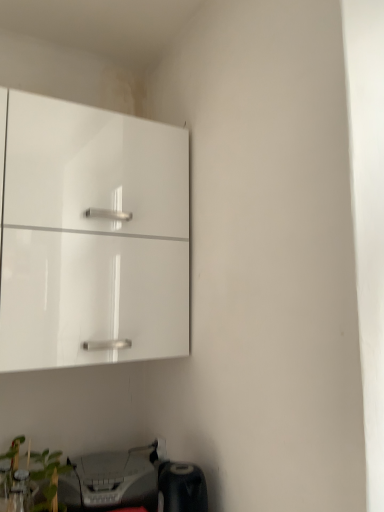
Question: Could green leafy plant at lower left be considered to be inside matte gray printer at lower left?

Choices:
 (A) no
 (B) yes

Answer: (A)

Question: Does matte gray printer at lower left turn towards green leafy plant at lower left?

Choices:
 (A) no
 (B) yes

Answer: (A)

Question: Does matte gray printer at lower left have a larger size compared to green leafy plant at lower left?

Choices:
 (A) no
 (B) yes

Answer: (B)

Question: Does matte gray printer at lower left have a smaller size compared to green leafy plant at lower left?

Choices:
 (A) no
 (B) yes

Answer: (A)

Question: Is matte gray printer at lower left turned away from green leafy plant at lower left?

Choices:
 (A) no
 (B) yes

Answer: (A)

Question: From their relative heights in the image, would you say glossy white cabinet at upper left is taller or shorter than matte gray printer at lower left?

Choices:
 (A) short
 (B) tall

Answer: (B)

Question: From a real-world perspective, is glossy white cabinet at upper left positioned above or below matte gray printer at lower left?

Choices:
 (A) above
 (B) below

Answer: (A)

Question: Relative to matte gray printer at lower left, is glossy white cabinet at upper left in front or behind?

Choices:
 (A) front
 (B) behind

Answer: (A)

Question: From the image's perspective, is glossy white cabinet at upper left above or below matte gray printer at lower left?

Choices:
 (A) above
 (B) below

Answer: (A)

Question: From a real-world perspective, relative to glossy white cabinet at upper left, is matte gray printer at lower left vertically above or below?

Choices:
 (A) above
 (B) below

Answer: (B)

Question: Considering the positions of matte gray printer at lower left and glossy white cabinet at upper left in the image, is matte gray printer at lower left bigger or smaller than glossy white cabinet at upper left?

Choices:
 (A) big
 (B) small

Answer: (B)

Question: In the image, is matte gray printer at lower left on the left side or the right side of glossy white cabinet at upper left?

Choices:
 (A) right
 (B) left

Answer: (A)

Question: Does point (97, 468) appear closer or farther from the camera than point (107, 142)?

Choices:
 (A) closer
 (B) farther

Answer: (B)

Question: In terms of size, does green leafy plant at lower left appear bigger or smaller than matte gray printer at lower left?

Choices:
 (A) small
 (B) big

Answer: (A)

Question: Is green leafy plant at lower left spatially inside matte gray printer at lower left, or outside of it?

Choices:
 (A) inside
 (B) outside

Answer: (B)